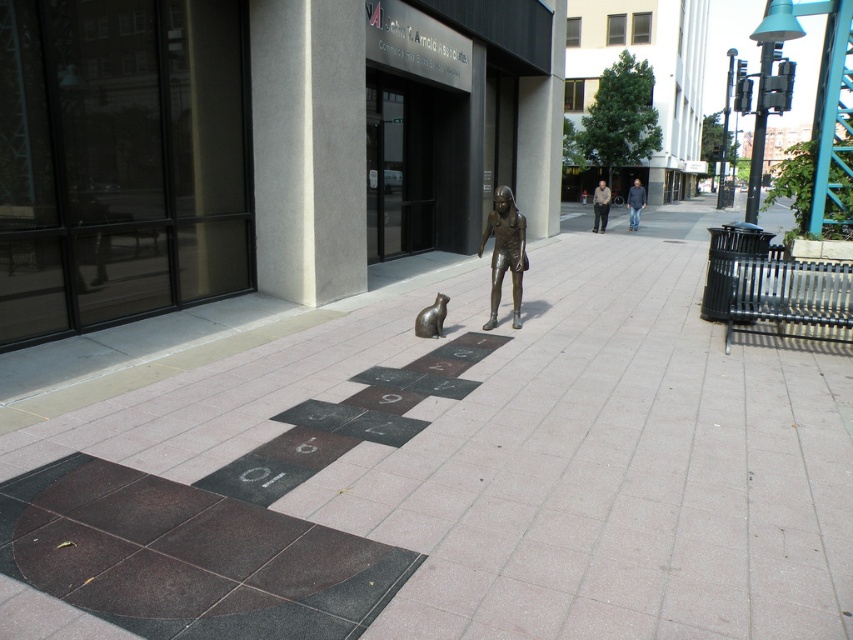
Question: Is smooth concrete pavement at center wider than bronze cat at center?

Choices:
 (A) yes
 (B) no

Answer: (A)

Question: Considering the relative positions of smooth concrete pavement at center and bronze statue at center in the image provided, where is smooth concrete pavement at center located with respect to bronze statue at center?

Choices:
 (A) left
 (B) right

Answer: (B)

Question: Among these points, which one is nearest to the camera?

Choices:
 (A) (82, 380)
 (B) (509, 193)
 (C) (440, 298)

Answer: (A)

Question: Among these objects, which one is nearest to the camera?

Choices:
 (A) bronze cat at center
 (B) smooth concrete pavement at center
 (C) bronze statue at center

Answer: (B)

Question: Which of the following is the farthest from the observer?

Choices:
 (A) bronze statue at center
 (B) bronze cat at center
 (C) smooth concrete pavement at center

Answer: (B)

Question: Does smooth concrete pavement at center have a larger size compared to bronze statue at center?

Choices:
 (A) no
 (B) yes

Answer: (B)